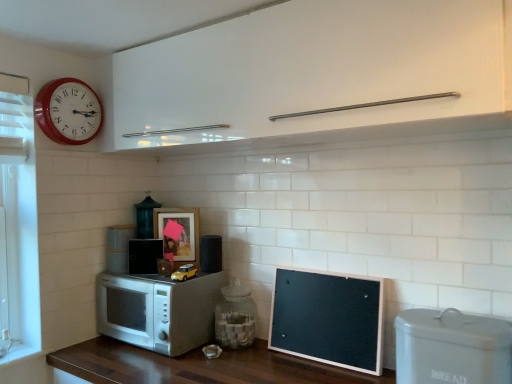
Question: Can you confirm if white glossy cabinet at upper center is shorter than white matte microwave at lower left, the 2th appliance from the back?

Choices:
 (A) yes
 (B) no

Answer: (B)

Question: Is white glossy cabinet at upper center wider than white matte microwave at lower left, marked as the first appliance in a left-to-right arrangement?

Choices:
 (A) yes
 (B) no

Answer: (B)

Question: Does white glossy cabinet at upper center have a lesser width compared to white matte microwave at lower left, the 2th appliance from the back?

Choices:
 (A) yes
 (B) no

Answer: (A)

Question: Would you consider white glossy cabinet at upper center to be distant from white matte microwave at lower left, marked as the fifth appliance in a front-to-back arrangement?

Choices:
 (A) yes
 (B) no

Answer: (B)

Question: From a real-world perspective, is white glossy cabinet at upper center located higher than white matte microwave at lower left, the 2th appliance from the back?

Choices:
 (A) yes
 (B) no

Answer: (A)

Question: Considering the relative sizes of white glossy cabinet at upper center and white matte microwave at lower left, which is counted as the 6th appliance, starting from the right, in the image provided, is white glossy cabinet at upper center bigger than white matte microwave at lower left, which is counted as the 6th appliance, starting from the right,?

Choices:
 (A) no
 (B) yes

Answer: (B)

Question: Does metallic green lantern at center, which is counted as the fifth appliance, starting from the right, have a lesser width compared to white plastic bread bin at lower right, which ranks as the first appliance in front-to-back order?

Choices:
 (A) yes
 (B) no

Answer: (B)

Question: Considering the relative sizes of metallic green lantern at center, which appears as the 1th appliance when viewed from the back, and white plastic bread bin at lower right, which ranks as the first appliance in front-to-back order, in the image provided, is metallic green lantern at center, which appears as the 1th appliance when viewed from the back, taller than white plastic bread bin at lower right, which ranks as the first appliance in front-to-back order,?

Choices:
 (A) no
 (B) yes

Answer: (A)

Question: From a real-world perspective, is metallic green lantern at center, which is counted as the fifth appliance, starting from the right, below white plastic bread bin at lower right, acting as the 6th appliance starting from the back?

Choices:
 (A) yes
 (B) no

Answer: (B)

Question: Is metallic green lantern at center, the 2th appliance viewed from the left, positioned in front of white plastic bread bin at lower right, which ranks as the first appliance in front-to-back order?

Choices:
 (A) yes
 (B) no

Answer: (B)

Question: Is metallic green lantern at center, the 6th appliance viewed from the front, smaller than white plastic bread bin at lower right, acting as the 6th appliance starting from the back?

Choices:
 (A) yes
 (B) no

Answer: (A)

Question: Does metallic green lantern at center, which is counted as the fifth appliance, starting from the right, have a greater width compared to white plastic bread bin at lower right, acting as the 6th appliance starting from the back?

Choices:
 (A) no
 (B) yes

Answer: (B)

Question: Would you say black matte speaker at center, the third appliance in the back-to-front sequence, is part of matte wooden picture frame at center's contents?

Choices:
 (A) no
 (B) yes

Answer: (A)